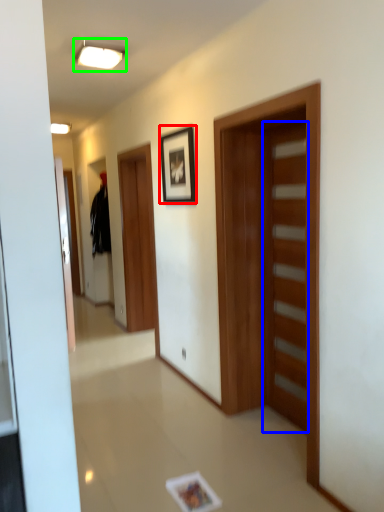
Question: Which object is the closest to the picture frame (highlighted by a red box)? Choose among these: door (highlighted by a blue box) or light fixture (highlighted by a green box).

Choices:
 (A) door
 (B) light fixture

Answer: (B)